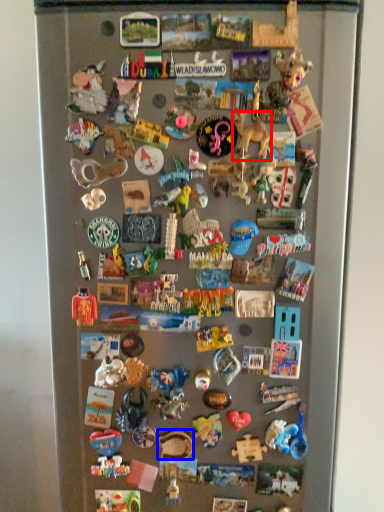
Question: Which object is further to the camera taking this photo, toy (highlighted by a red box) or toy (highlighted by a blue box)?

Choices:
 (A) toy
 (B) toy

Answer: (B)